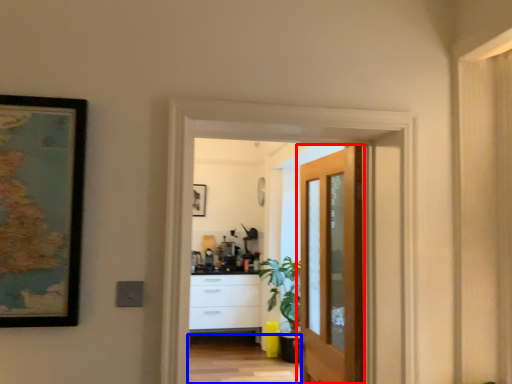
Question: Among these objects, which one is nearest to the camera, door (highlighted by a red box) or path (highlighted by a blue box)?

Choices:
 (A) door
 (B) path

Answer: (A)